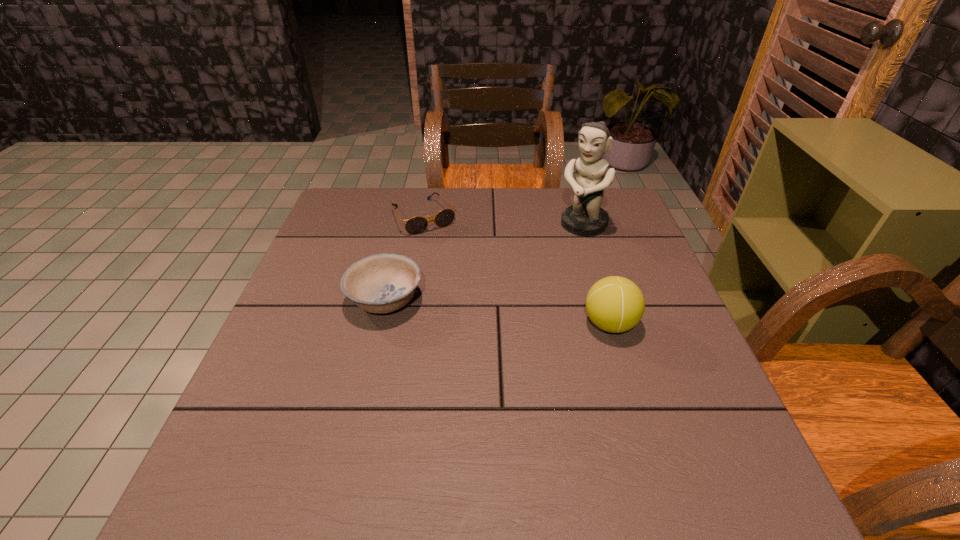
The image size is (960, 540). I want to click on free space on the desktop that is between the second shortest object and the third shortest object and is positioned on the lenses of the shortest object, so click(490, 311).

Locate an element on the screen. free space on the desktop that is between the bowl and the tennis ball and is positioned on the front-facing side of the figurine is located at coordinates (493, 311).